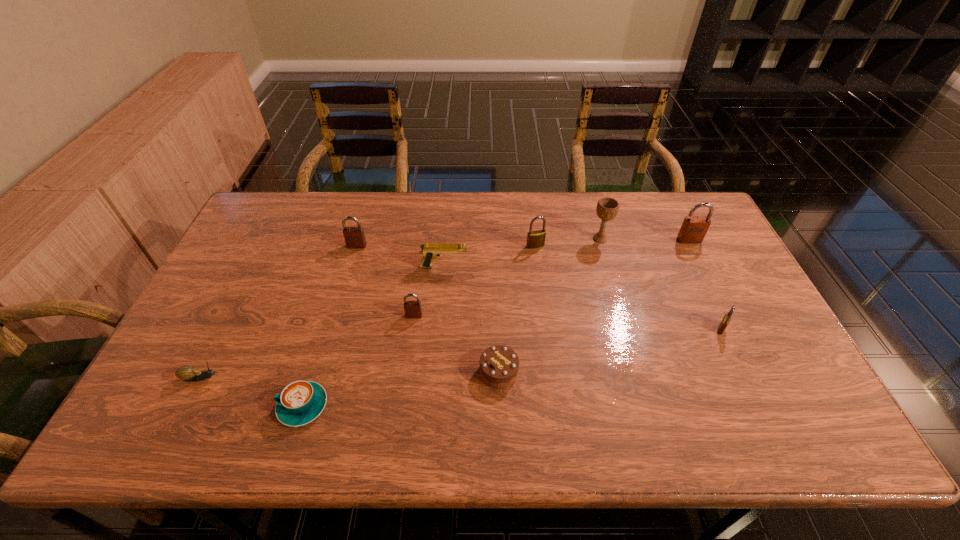
Locate an element on the screen. vacant space located on the left of the seventh object from left to right is located at coordinates (495, 246).

Find the location of a particular element. This screenshot has height=540, width=960. free location located 0.250m on the front-facing side of the second smallest brown padlock is located at coordinates (339, 308).

Where is `free region located 0.330m at the barrel of the sixth nearest object`? The height and width of the screenshot is (540, 960). free region located 0.330m at the barrel of the sixth nearest object is located at coordinates (574, 267).

Locate an element on the screen. This screenshot has width=960, height=540. vacant space situated on the front of the fourth nearest object is located at coordinates (766, 423).

You are a GUI agent. You are given a task and a screenshot of the screen. Output one action in this format:
    pyautogui.click(x=<x>, y=<y>)
    Task: Click on the vacant space located 0.210m on the front-facing side of the second padlock from left to right
    
    Given the screenshot: What is the action you would take?
    pyautogui.click(x=405, y=386)

Locate an element on the screen. The image size is (960, 540). vacant position located 0.250m on the left of the third shortest object is located at coordinates (379, 372).

Identify the location of vacant space located 0.160m with the handle on the right side of the turquoise cappuccino. (210, 406).

At what (x,y) coordinates should I click in order to perform the action: click on vacant area located 0.160m with the handle on the right side of the turquoise cappuccino. Please return your answer as a coordinate pair (x, y). Looking at the image, I should click on (210, 406).

This screenshot has width=960, height=540. I want to click on blank space located with the handle on the right side of the turquoise cappuccino, so click(198, 406).

Locate an element on the screen. vacant space located 0.270m on the front-facing side of the escargot is located at coordinates (331, 378).